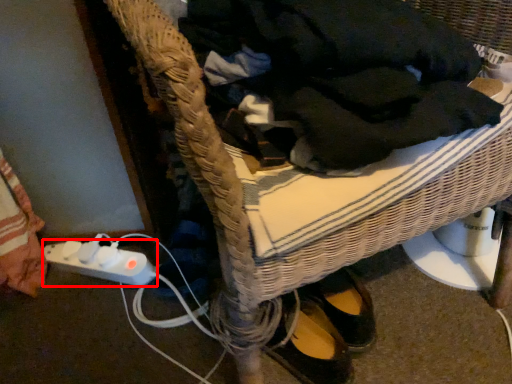
Question: From the image's perspective, what is the correct spatial positioning of plug (annotated by the red box) in reference to clothing?

Choices:
 (A) above
 (B) below

Answer: (B)